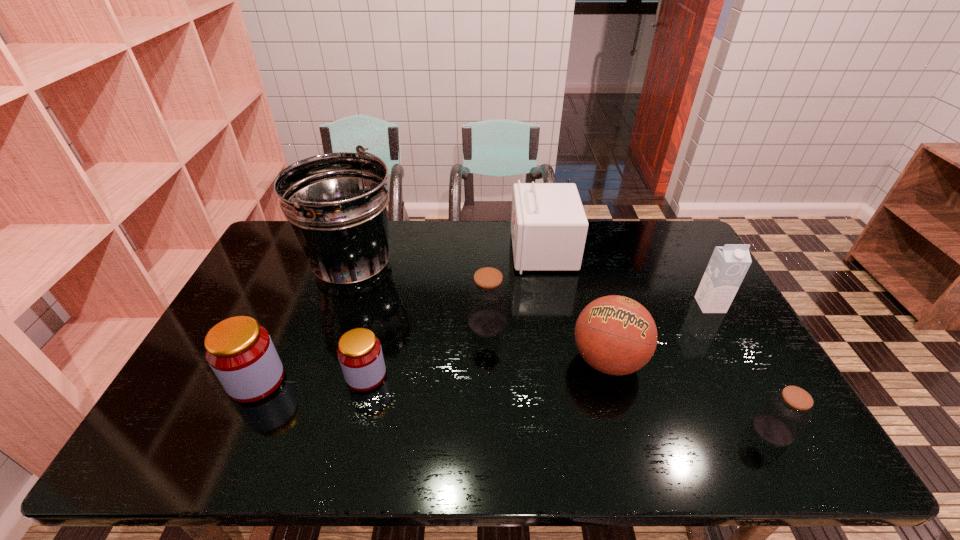
Where is `bucket`? The height and width of the screenshot is (540, 960). bucket is located at coordinates (337, 203).

The image size is (960, 540). Identify the location of white first-aid kit. (549, 227).

Where is `carton`? Image resolution: width=960 pixels, height=540 pixels. carton is located at coordinates (728, 265).

Locate an element on the screen. The image size is (960, 540). basketball is located at coordinates (616, 335).

Find the location of a particular element. This screenshot has width=960, height=540. the left brown jar is located at coordinates (487, 294).

Where is `the farthest jar`? Image resolution: width=960 pixels, height=540 pixels. the farthest jar is located at coordinates (487, 294).

Where is `the bigger red jar`? the bigger red jar is located at coordinates point(240,352).

You are a GUI agent. You are given a task and a screenshot of the screen. Output one action in this format:
    pyautogui.click(x=<x>, y=<y>)
    Task: Click on the leftmost jar
    
    Given the screenshot: What is the action you would take?
    click(240, 352)

The height and width of the screenshot is (540, 960). I want to click on the smaller red jar, so click(359, 352).

The height and width of the screenshot is (540, 960). In order to click on the third jar from right to left in this screenshot , I will do `click(359, 352)`.